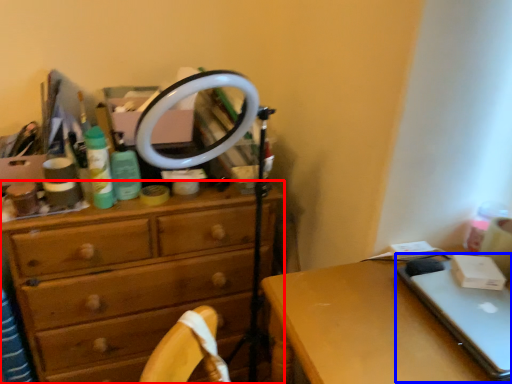
Question: Which object appears closest to the camera in this image, chest of drawers (highlighted by a red box) or laptop (highlighted by a blue box)?

Choices:
 (A) chest of drawers
 (B) laptop

Answer: (B)